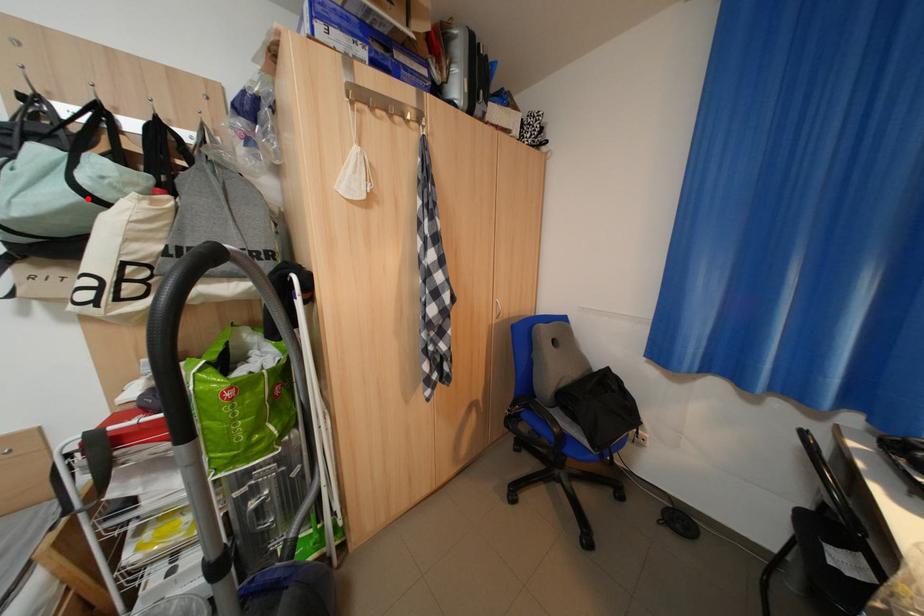
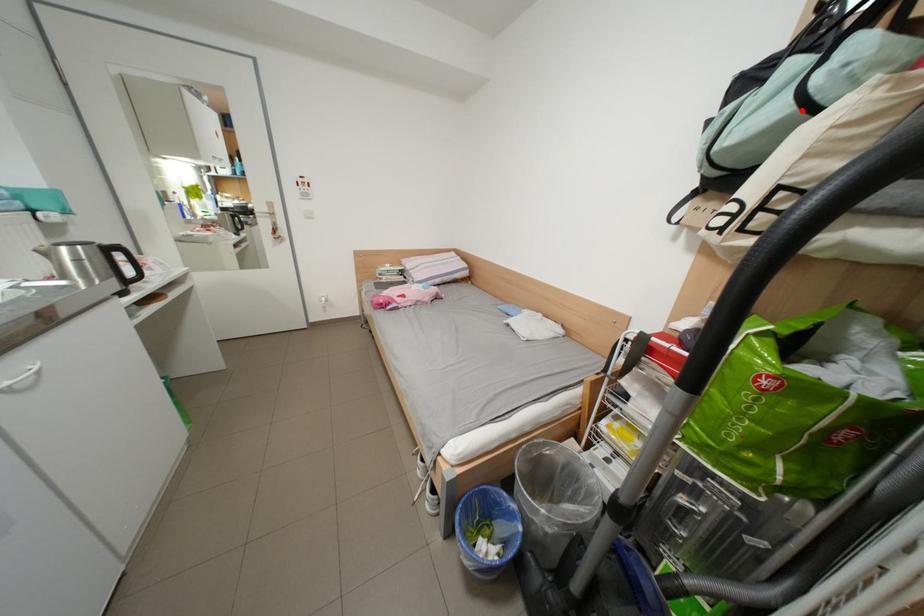
I am providing you with two images of the same scene from different viewpoints. A red point is marked on the first image and another point is marked on the second image. Are the points marked in image1 and image2 representing the same 3D position?

Yes